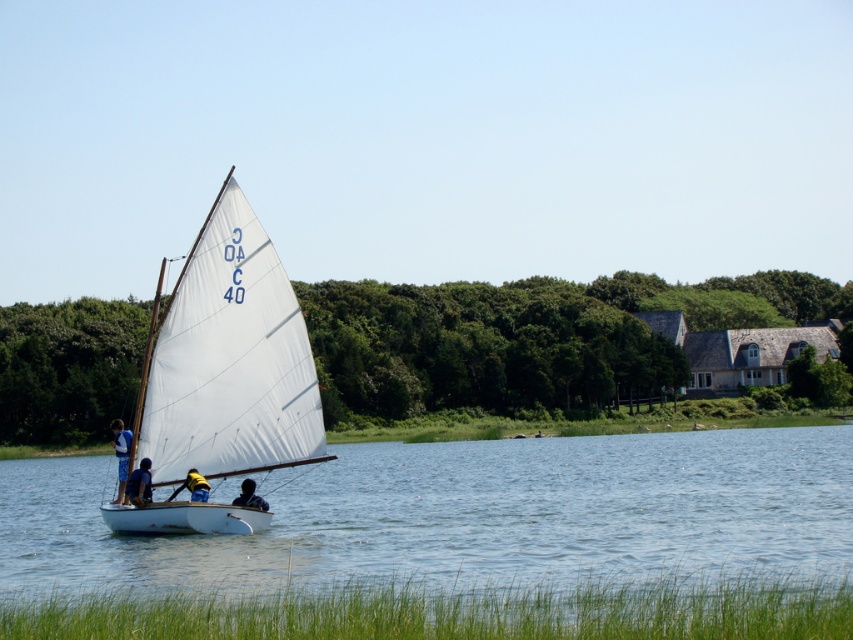
You are standing on the dock and see the white matte sailboat at center and the dark blue fabric shirt at lower center. Which object is closer to you?

The white matte sailboat at center is closer to you than the dark blue fabric shirt at lower center.

You are a drone operator tasked with capturing aerial footage of the white matte sailboat at center. The sailboat is currently at coordinates point 0.564, 0.270. Your drone needs to maintain a safe distance of at least 0.3 units from the boat to avoid interference. Can your drone safely hover at point 0.6, 0.3 without getting too close?

The white matte sailboat at center is located at point (x=229, y=360). The distance between the drone at point (x=254, y=384) and the boat is calculated as follows. The horizontal distance is 0.6 minus 0.564 equals 0.036 units. The vertical distance is 0.3 minus 0.270 equals 0.03 units. The total distance is the square root of 0.036 squared plus 0.03 squared. That equals sqrt of 0.001296 plus 0.0009, which is sqrt of 0.002196 approximately 0.0469 units. Since the required safe distance is 0.3 units, the drone is 0.

You are a photographer standing on the dock and want to take a photo of the blue fabric life vest at center and the dark blue fabric shirt at lower center. If your camera has a maximum zoom range of 10 meters, will you be able to capture both objects clearly in one shot without moving closer?

The blue fabric life vest at center is 7.07 meters away from the dark blue fabric shirt at lower center. Since the camera can zoom up to 10 meters, which is greater than the distance between them, you can capture both objects in one shot without moving closer.